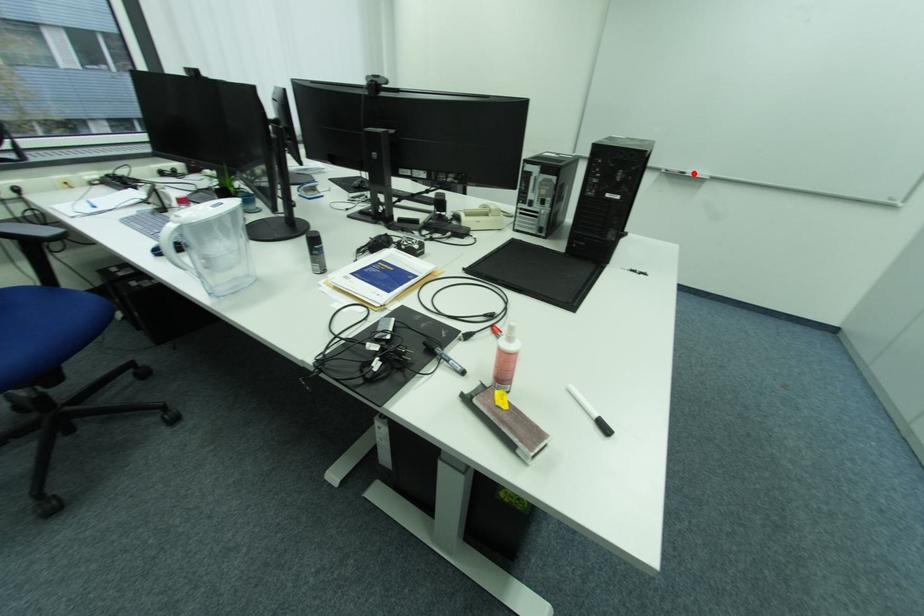
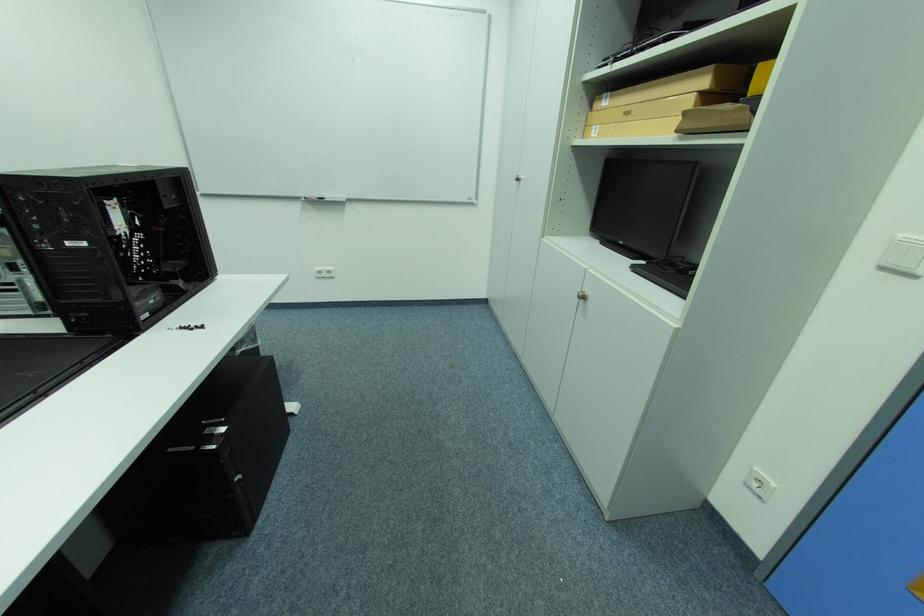
Locate, in the second image, the point that corresponds to the highlighted location in the first image.

(331, 199)